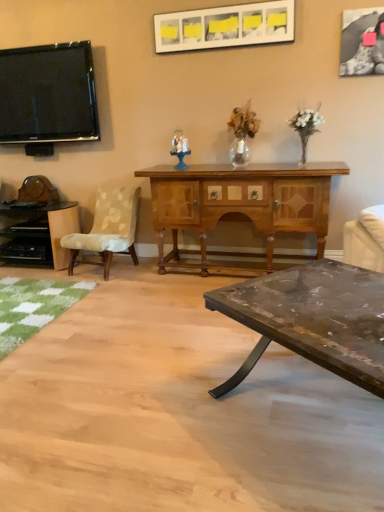
Locate an element on the screen. This screenshot has width=384, height=512. blank space above white glossy picture frame at upper center, acting as the 1th picture frame starting from the left (from a real-world perspective) is located at coordinates (222, 7).